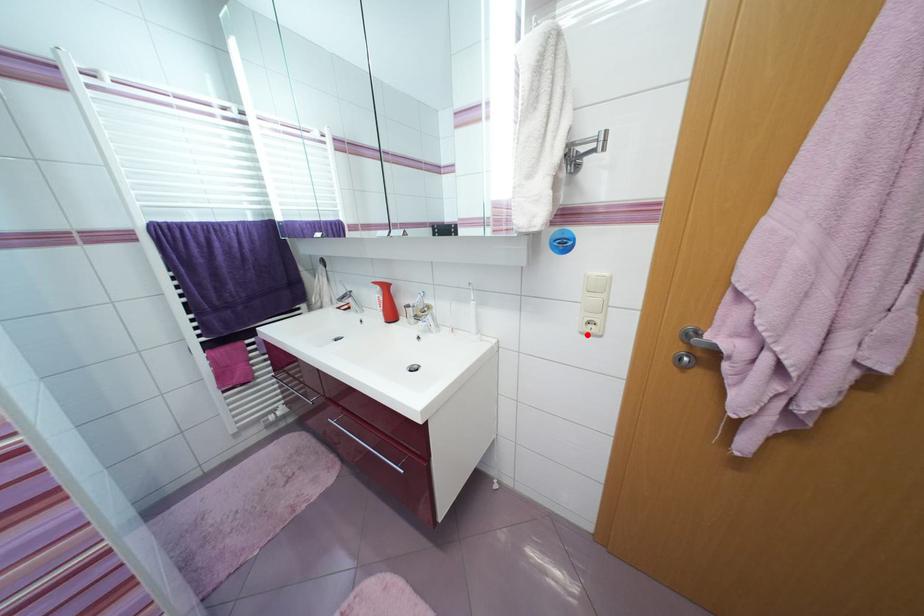
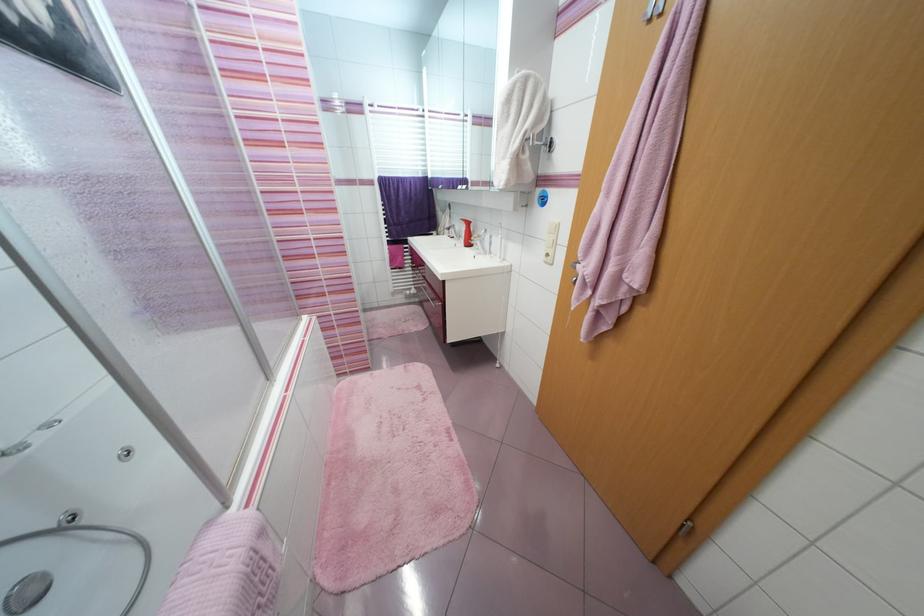
The point at the highlighted location is marked in the first image. Where is the corresponding point in the second image?

(551, 264)